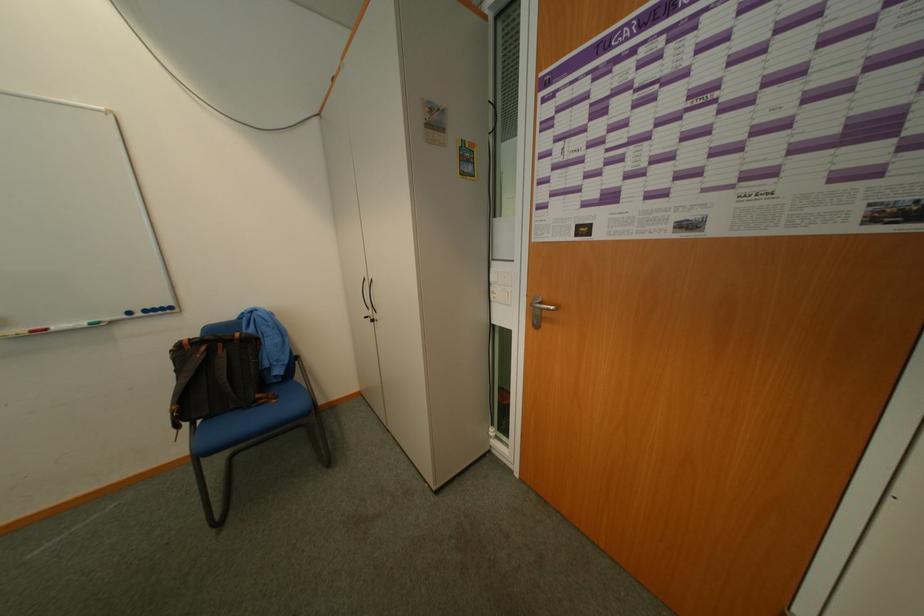
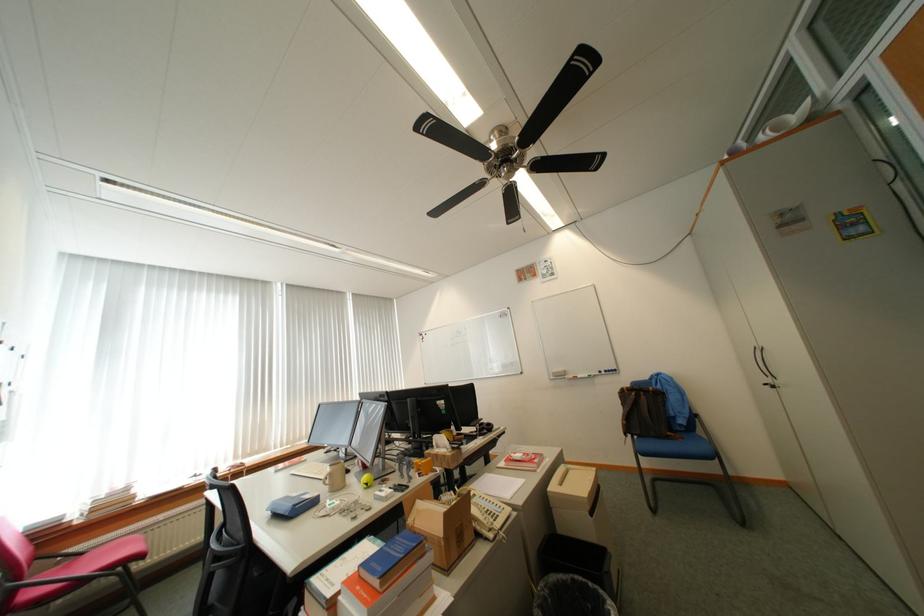
Find the pixel in the second image that matches point 231,354 in the first image.

(652, 399)